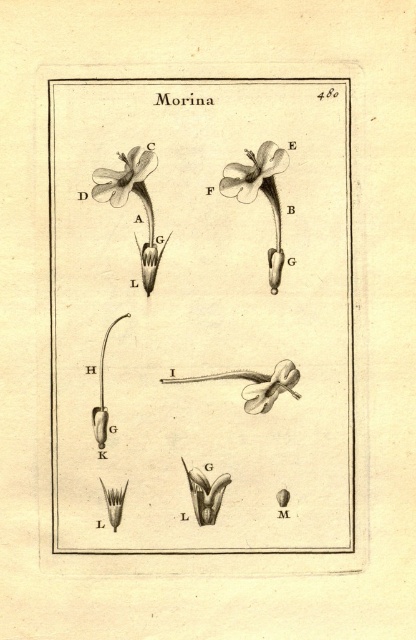
Question: Among these points, which one is farthest from the camera?

Choices:
 (A) (113, 198)
 (B) (269, 381)
 (C) (232, 168)

Answer: (B)

Question: Is white paper flower at upper center positioned behind matte white flower at center?

Choices:
 (A) no
 (B) yes

Answer: (A)

Question: Which point appears closest to the camera in this image?

Choices:
 (A) (239, 182)
 (B) (260, 396)

Answer: (B)

Question: Which is farther from the black ink pen at upper center?

Choices:
 (A) matte white flower at upper left
 (B) matte white flower at center
 (C) white paper flower at upper center

Answer: (A)

Question: Is white paper flower at upper center to the right of matte white flower at center from the viewer's perspective?

Choices:
 (A) no
 (B) yes

Answer: (A)

Question: Can you confirm if black ink pen at upper center is positioned to the left of white paper flower at upper center?

Choices:
 (A) no
 (B) yes

Answer: (B)